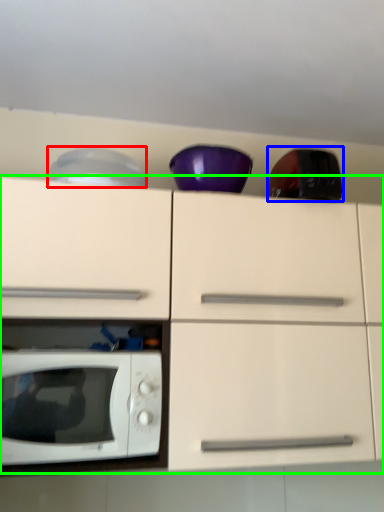
Question: Which is farther away from appliance (highlighted by a red box)? appliance (highlighted by a blue box) or cabinetry (highlighted by a green box)?

Choices:
 (A) appliance
 (B) cabinetry

Answer: (A)